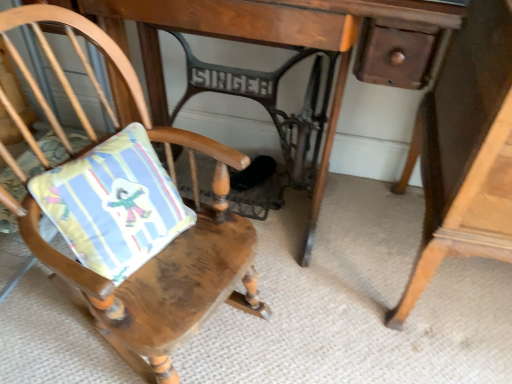
Question: From the image's perspective, is wooden cushioned chair at center located above or below striped fabric cushion at left?

Choices:
 (A) below
 (B) above

Answer: (A)

Question: Is wooden cushioned chair at center in front of or behind striped fabric cushion at left in the image?

Choices:
 (A) front
 (B) behind

Answer: (A)

Question: Based on their relative distances, which object is nearer to the striped fabric cushion at left?

Choices:
 (A) wooden table at center
 (B) wooden cushioned chair at center

Answer: (B)

Question: Estimate the real-world distances between objects in this image. Which object is farther from the striped fabric cushion at left?

Choices:
 (A) wooden table at center
 (B) wooden cushioned chair at center

Answer: (A)